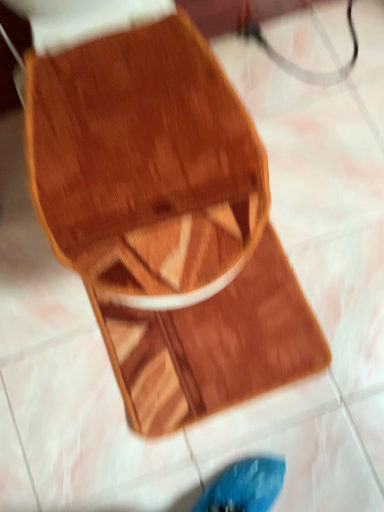
Where is `wooden shoe at center`? The height and width of the screenshot is (512, 384). wooden shoe at center is located at coordinates (165, 223).

What do you see at coordinates (165, 223) in the screenshot?
I see `wooden shoe at center` at bounding box center [165, 223].

What do you see at coordinates (213, 345) in the screenshot? Image resolution: width=384 pixels, height=512 pixels. I see `wooden cutting board at center` at bounding box center [213, 345].

Locate an element on the screen. This screenshot has width=384, height=512. wooden cutting board at center is located at coordinates (213, 345).

This screenshot has height=512, width=384. I want to click on wooden shoe at center, so click(165, 223).

In the scene shown: Which object is positioned more to the left, wooden shoe at center or wooden cutting board at center?

Positioned to the left is wooden cutting board at center.

Is wooden shoe at center in front of or behind wooden cutting board at center in the image?

Clearly, wooden shoe at center is in front of wooden cutting board at center.

Which is behind, point (135, 71) or point (215, 354)?

The point (215, 354) is farther from the camera.

In the scene shown: From the image's perspective, which one is positioned lower, wooden shoe at center or wooden cutting board at center?

From the image's view, wooden cutting board at center is below.

From a real-world perspective, is wooden shoe at center over wooden cutting board at center?

No, from a real-world perspective, wooden shoe at center is not on top of wooden cutting board at center.

Considering the relative sizes of wooden shoe at center and wooden cutting board at center in the image provided, is wooden shoe at center wider than wooden cutting board at center?

Indeed, wooden shoe at center has a greater width compared to wooden cutting board at center.

In terms of height, does wooden shoe at center look taller or shorter compared to wooden cutting board at center?

In the image, wooden shoe at center appears to be taller than wooden cutting board at center.

Looking at this image, is wooden shoe at center bigger or smaller than wooden cutting board at center?

wooden shoe at center is bigger than wooden cutting board at center.

Would you say wooden shoe at center is outside wooden cutting board at center?

That's correct, wooden shoe at center is outside of wooden cutting board at center.

In the scene shown: Does wooden shoe at center touch wooden cutting board at center?

No, wooden shoe at center is not in contact with wooden cutting board at center.

Could you tell me if wooden shoe at center is facing wooden cutting board at center?

Yes, wooden shoe at center is aimed at wooden cutting board at center.

What's the angular difference between wooden shoe at center and wooden cutting board at center's facing directions?

There is a 90.4-degree angle between the facing directions of wooden shoe at center and wooden cutting board at center.

Measure the distance from wooden shoe at center to wooden cutting board at center.

wooden shoe at center and wooden cutting board at center are 16.28 inches apart from each other.

The image size is (384, 512). Identify the location of mat on the left of wooden shoe at center. (213, 345).

Which object is positioned more to the left, wooden cutting board at center or wooden shoe at center?

wooden cutting board at center.

Relative to wooden shoe at center, is wooden cutting board at center in front or behind?

wooden cutting board at center is behind wooden shoe at center.

Between point (128, 365) and point (157, 248), which one is positioned in front?

The point (157, 248) is closer to the camera.

From the image's perspective, is wooden cutting board at center on wooden shoe at center?

No.

From a real-world perspective, is wooden cutting board at center above or below wooden shoe at center?

In terms of real-world spatial position, wooden cutting board at center is above wooden shoe at center.

Between wooden cutting board at center and wooden shoe at center, which one has larger width?

wooden shoe at center.

Can you confirm if wooden cutting board at center is taller than wooden shoe at center?

No, wooden cutting board at center is not taller than wooden shoe at center.

Can you confirm if wooden cutting board at center is bigger than wooden shoe at center?

Incorrect, wooden cutting board at center is not larger than wooden shoe at center.

Would you say wooden shoe at center is part of wooden cutting board at center's contents?

No, wooden shoe at center is not a part of wooden cutting board at center.

Is wooden cutting board at center far away from wooden shoe at center?

wooden cutting board at center is actually quite close to wooden shoe at center.

Could you tell me if wooden cutting board at center is facing wooden shoe at center?

Yes, wooden cutting board at center is turned towards wooden shoe at center.

What's the angular difference between wooden cutting board at center and wooden shoe at center's facing directions?

wooden cutting board at center and wooden shoe at center are facing 90.4 degrees away from each other.

The width and height of the screenshot is (384, 512). What are the coordinates of `mat that appears below the wooden shoe at center (from the image's perspective)` in the screenshot? It's located at (213, 345).

At what (x,y) coordinates should I click in order to perform the action: click on footwear located underneath the wooden cutting board at center (from a real-world perspective). Please return your answer as a coordinate pair (x, y). Looking at the image, I should click on pos(165,223).

The height and width of the screenshot is (512, 384). I want to click on footwear lying in front of the wooden cutting board at center, so click(x=165, y=223).